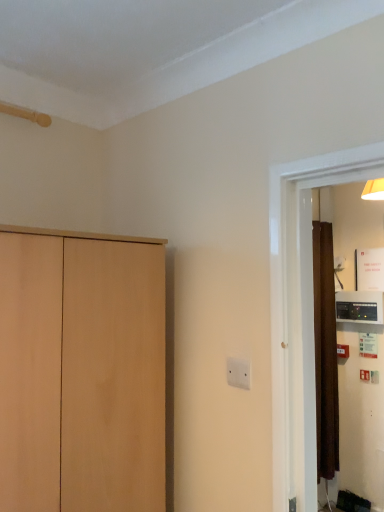
Question: Is black plastic thermostat at right closer to the viewer compared to white plastic electric outlet at center?

Choices:
 (A) no
 (B) yes

Answer: (A)

Question: From the image's perspective, is black plastic thermostat at right above white plastic electric outlet at center?

Choices:
 (A) no
 (B) yes

Answer: (A)

Question: Is black plastic thermostat at right smaller than white plastic electric outlet at center?

Choices:
 (A) no
 (B) yes

Answer: (A)

Question: Is black plastic thermostat at right next to white plastic electric outlet at center and touching it?

Choices:
 (A) yes
 (B) no

Answer: (B)

Question: Can you confirm if black plastic thermostat at right is taller than white plastic electric outlet at center?

Choices:
 (A) no
 (B) yes

Answer: (B)

Question: Does black plastic thermostat at right have a lesser width compared to white plastic electric outlet at center?

Choices:
 (A) yes
 (B) no

Answer: (B)

Question: Is light wood cupboard at left completely or partially outside of white plastic electric outlet at center?

Choices:
 (A) no
 (B) yes

Answer: (B)

Question: Is light wood cupboard at left at the right side of white plastic electric outlet at center?

Choices:
 (A) yes
 (B) no

Answer: (B)

Question: Is light wood cupboard at left not close to white plastic electric outlet at center?

Choices:
 (A) no
 (B) yes

Answer: (A)

Question: Can you confirm if light wood cupboard at left is taller than white plastic electric outlet at center?

Choices:
 (A) no
 (B) yes

Answer: (B)

Question: From a real-world perspective, is light wood cupboard at left over white plastic electric outlet at center?

Choices:
 (A) no
 (B) yes

Answer: (A)

Question: Considering the relative positions of light wood cupboard at left and white plastic electric outlet at center in the image provided, is light wood cupboard at left behind white plastic electric outlet at center?

Choices:
 (A) yes
 (B) no

Answer: (B)

Question: From a real-world perspective, is light wood cupboard at left over black plastic thermostat at right?

Choices:
 (A) yes
 (B) no

Answer: (B)